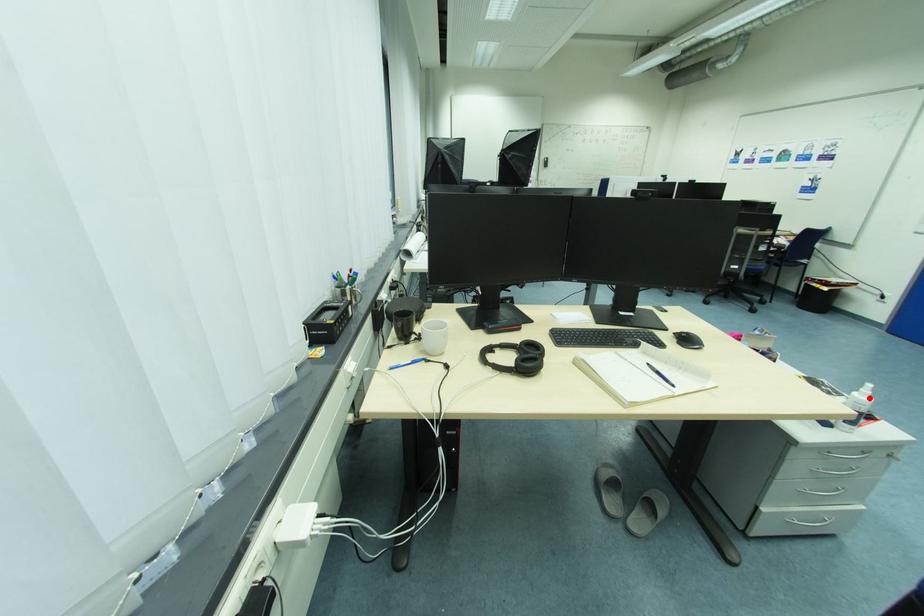
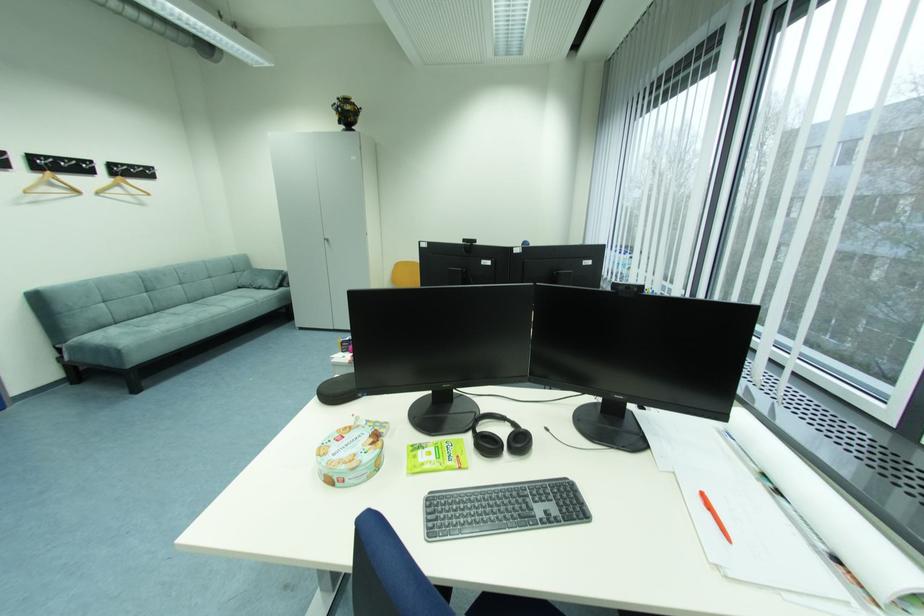
Question: I am providing you with two images of the same scene from different viewpoints. A red point is marked on the first image. At the location where the point appears in image 1, is it still visible in image 2?

Choices:
 (A) Yes
 (B) No

Answer: (B)